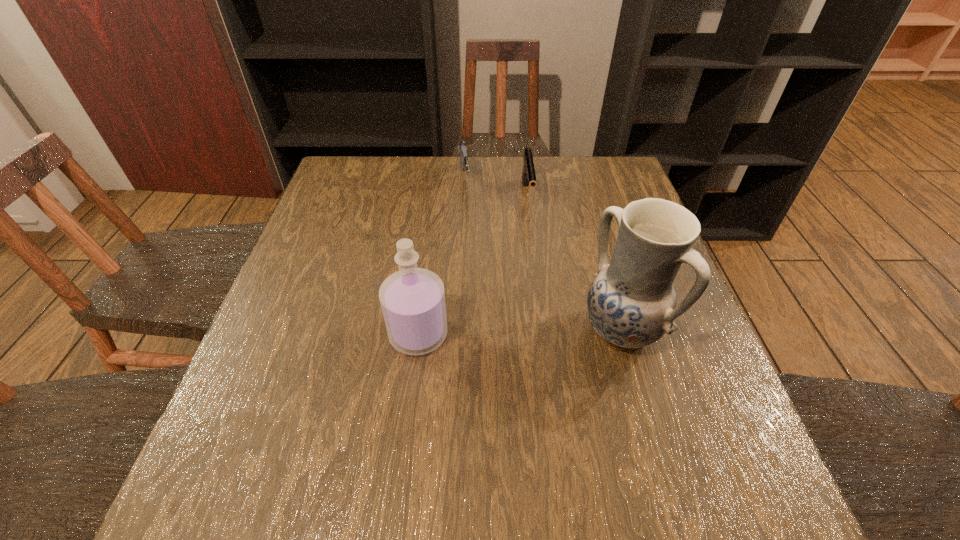
Find the location of `vacant space on the desktop that is between the perfume and the rightmost object and is positioned at the muzzle of the third object from left to right`. vacant space on the desktop that is between the perfume and the rightmost object and is positioned at the muzzle of the third object from left to right is located at coordinates (545, 331).

Image resolution: width=960 pixels, height=540 pixels. What are the coordinates of `vacant spot on the desktop that is between the perfume and the pottery and is positioned at the barrel of the gun` in the screenshot? It's located at tap(492, 332).